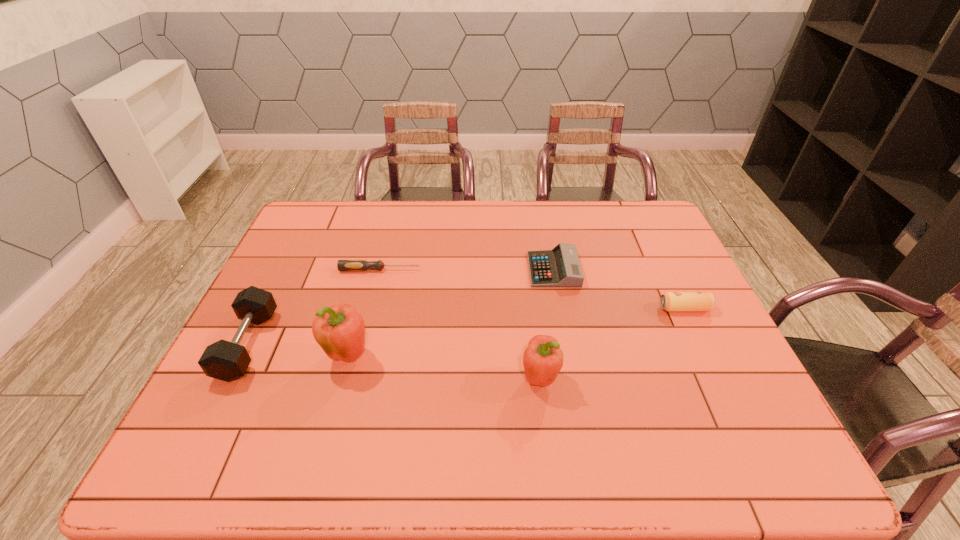
The image size is (960, 540). I want to click on vacant area that lies between the rightmost object and the calculator, so click(619, 289).

Image resolution: width=960 pixels, height=540 pixels. I want to click on vacant region between the right pepper and the rightmost object, so click(x=612, y=344).

The height and width of the screenshot is (540, 960). I want to click on free space between the dumbbell and the screwdriver, so click(314, 307).

Find the location of a particular element. free space that is in between the beer can and the screwdriver is located at coordinates (532, 289).

You are a GUI agent. You are given a task and a screenshot of the screen. Output one action in this format:
    pyautogui.click(x=<x>, y=<y>)
    Task: Click on the object identified as the closest to the taller pepper
    Image resolution: width=960 pixels, height=540 pixels.
    Given the screenshot: What is the action you would take?
    pyautogui.click(x=227, y=361)

Locate an element on the screen. This screenshot has width=960, height=540. object that stands as the fourth closest to the second shortest object is located at coordinates (340, 330).

Locate an element on the screen. This screenshot has height=540, width=960. vacant area that satisfies the following two spatial constraints: 1. insert the rightmost object into a screw head; 2. on the right side of the screwdriver is located at coordinates (370, 308).

Find the location of a particular element. vacant space that satisfies the following two spatial constraints: 1. insert the screwdriver into a screw head; 2. on the back side of the fourth tallest object is located at coordinates (370, 308).

Locate an element on the screen. The height and width of the screenshot is (540, 960). free space in the image that satisfies the following two spatial constraints: 1. on the front side of the second tallest object; 2. on the left side of the tallest object is located at coordinates (344, 379).